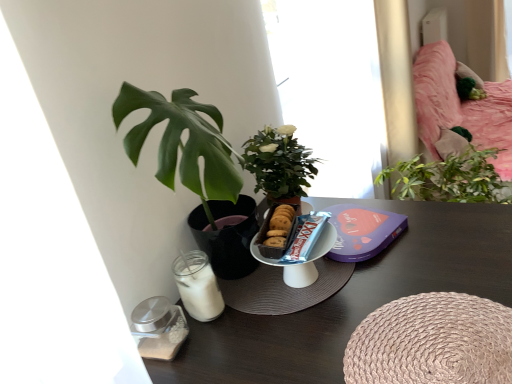
The height and width of the screenshot is (384, 512). In order to click on vacant space in woven beige placemat at lower right (from a real-world perspective) in this screenshot , I will do `click(438, 342)`.